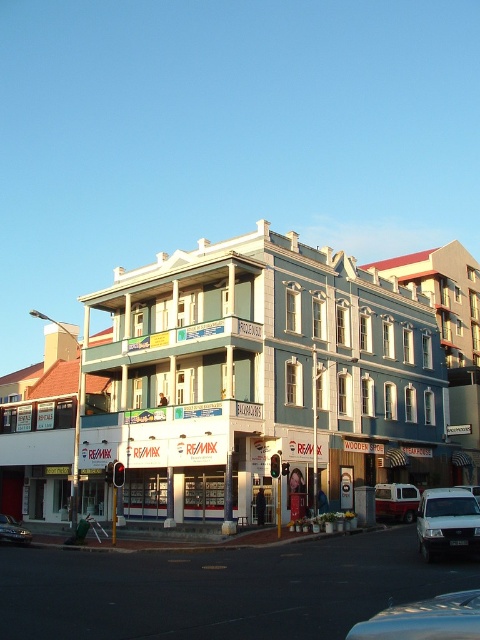
Question: Is shiny silver car at lower right below white matte van at lower right?

Choices:
 (A) no
 (B) yes

Answer: (A)

Question: Estimate the real-world distances between objects in this image. Which object is farther from the white painted building at center?

Choices:
 (A) white matte van at lower right
 (B) metallic silver van at center
 (C) white matte van at center
 (D) shiny silver car at lower left

Answer: (A)

Question: Which object appears farthest from the camera in this image?

Choices:
 (A) white painted building at center
 (B) metallic silver van at center

Answer: (B)

Question: Among these points, which one is nearest to the camera?

Choices:
 (A) (477, 490)
 (B) (385, 486)

Answer: (A)

Question: Does shiny silver car at lower right lie behind shiny silver car at lower left?

Choices:
 (A) yes
 (B) no

Answer: (B)

Question: Is the position of white painted building at center less distant than that of shiny silver car at lower right?

Choices:
 (A) yes
 (B) no

Answer: (B)